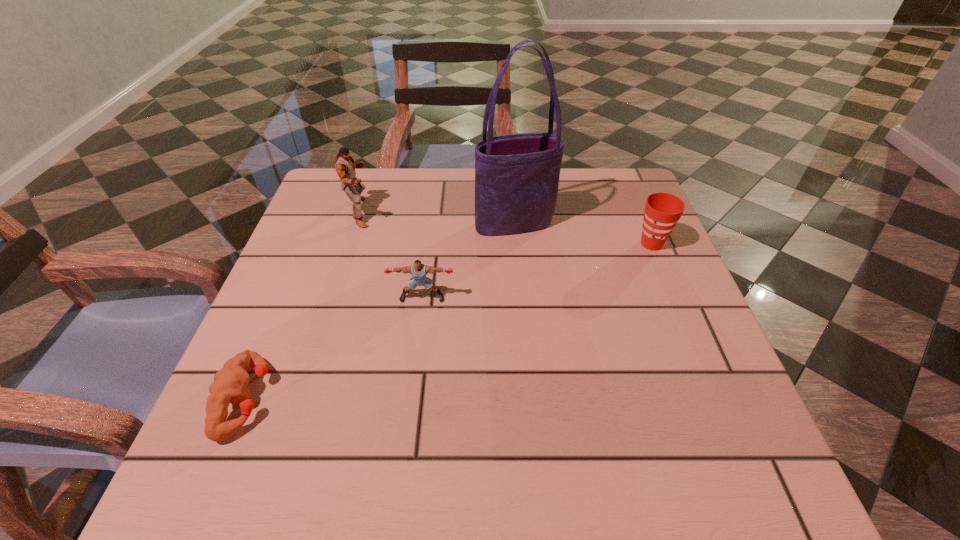
You are a GUI agent. You are given a task and a screenshot of the screen. Output one action in this format:
    pyautogui.click(x=<x>, y=<y>)
    Task: Click on the vacant region located 0.110m on the front-facing side of the tallest puncher
    
    Given the screenshot: What is the action you would take?
    pyautogui.click(x=419, y=212)

Find the location of a particular element. vacant space situated on the left of the rightmost object is located at coordinates (595, 244).

I want to click on free spot located on the front-facing side of the rightmost puncher, so click(x=416, y=348).

The height and width of the screenshot is (540, 960). Find the location of `free space located with the gloves of the shortest puncher facing forward`. free space located with the gloves of the shortest puncher facing forward is located at coordinates (466, 399).

Find the location of a particular element. The image size is (960, 540). tote bag located in the far edge section of the desktop is located at coordinates (517, 176).

The image size is (960, 540). I want to click on puncher that is at the far edge, so click(345, 165).

The height and width of the screenshot is (540, 960). In order to click on object at the near edge in this screenshot , I will do `click(230, 383)`.

At what (x,y) coordinates should I click in order to perform the action: click on object that is positioned at the right edge. Please return your answer as a coordinate pair (x, y). The width and height of the screenshot is (960, 540). Looking at the image, I should click on (662, 211).

Where is `object that is at the far left corner`? object that is at the far left corner is located at coordinates (345, 165).

Find the location of a particular element. The width and height of the screenshot is (960, 540). object that is at the near left corner is located at coordinates (230, 383).